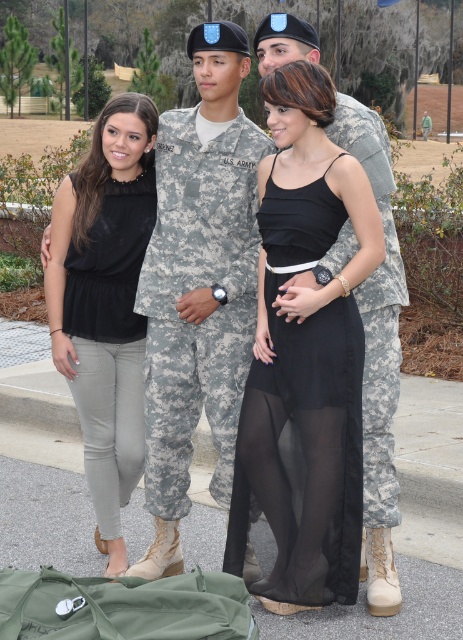
You are a photographer trying to capture a clear shot of both the camouflage uniform at center and the camouflage fabric us army uniform at center. Which one will appear closer to you in the photo?

The camouflage uniform at center will appear closer to you in the photo because it is further to the viewer than the camouflage fabric us army uniform at center.

You are standing at the origin point of the coordinate system. Which direction should you move to reach the camouflage uniform at center?

The camouflage uniform at center is located at point [199,284], so you should move northeast to reach it.

You are standing at point (214, 486) and want to walk to point (231, 68). Is there any obstruction between your current position and the destination?

Point (231, 68) is in front of point (214, 486), so there is no obstruction between them.